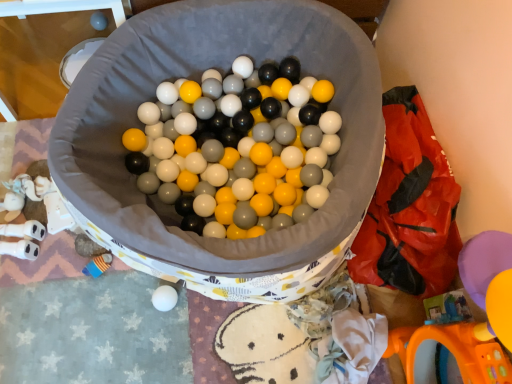
Question: Can you confirm if rubberized plastic bag at right is wider than matte gray ball at upper left?

Choices:
 (A) no
 (B) yes

Answer: (B)

Question: Is rubberized plastic bag at right facing towards matte gray ball at upper left?

Choices:
 (A) no
 (B) yes

Answer: (A)

Question: From the image's perspective, would you say rubberized plastic bag at right is shown under matte gray ball at upper left?

Choices:
 (A) no
 (B) yes

Answer: (B)

Question: Is the depth of rubberized plastic bag at right greater than that of matte gray ball at upper left?

Choices:
 (A) yes
 (B) no

Answer: (B)

Question: Considering the relative positions of rubberized plastic bag at right and matte gray ball at upper left in the image provided, is rubberized plastic bag at right to the left of matte gray ball at upper left from the viewer's perspective?

Choices:
 (A) no
 (B) yes

Answer: (A)

Question: Is rubberized plastic bag at right smaller than matte gray ball at upper left?

Choices:
 (A) yes
 (B) no

Answer: (B)

Question: Is matte gray ball at upper left placed right next to rubberized plastic bag at right?

Choices:
 (A) no
 (B) yes

Answer: (A)

Question: Is matte gray ball at upper left wider than rubberized plastic bag at right?

Choices:
 (A) no
 (B) yes

Answer: (A)

Question: Can you confirm if matte gray ball at upper left is positioned to the left of rubberized plastic bag at right?

Choices:
 (A) no
 (B) yes

Answer: (B)

Question: Does matte gray ball at upper left have a greater height compared to rubberized plastic bag at right?

Choices:
 (A) yes
 (B) no

Answer: (B)

Question: From a real-world perspective, does matte gray ball at upper left sit lower than rubberized plastic bag at right?

Choices:
 (A) yes
 (B) no

Answer: (A)

Question: Does matte gray ball at upper left have a lesser width compared to rubberized plastic bag at right?

Choices:
 (A) yes
 (B) no

Answer: (A)

Question: In terms of width, does matte gray ball at upper left look wider or thinner when compared to rubberized plastic bag at right?

Choices:
 (A) wide
 (B) thin

Answer: (B)